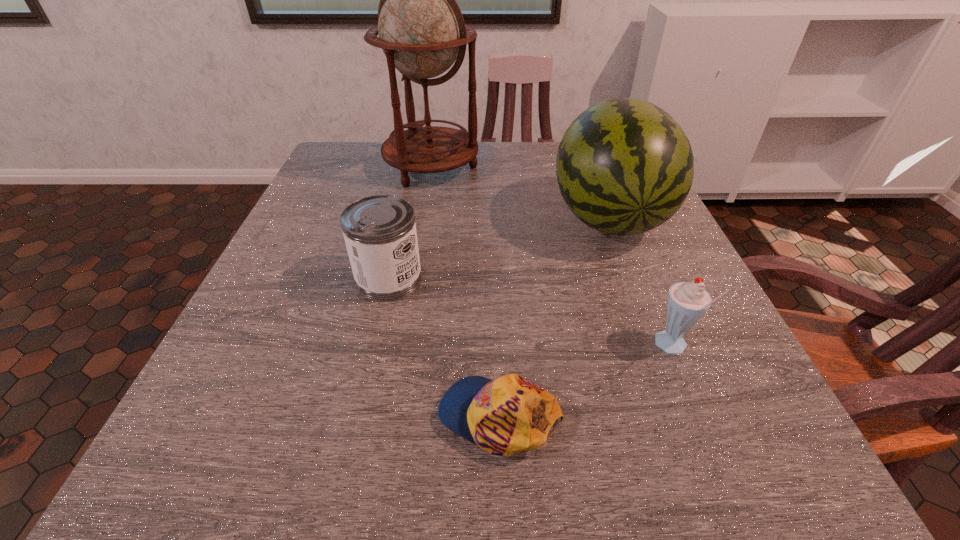
You are a GUI agent. You are given a task and a screenshot of the screen. Output one action in this format:
    pyautogui.click(x=<x>, y=<y>)
    Task: Click on the free point between the watermelon and the shortest object
    This screenshot has width=960, height=540.
    Given the screenshot: What is the action you would take?
    pyautogui.click(x=555, y=317)

Where is `free space between the shortest object and the fourth shortest object`? This screenshot has width=960, height=540. free space between the shortest object and the fourth shortest object is located at coordinates (555, 317).

Identify the location of vacant region between the fourth shortest object and the globe. The width and height of the screenshot is (960, 540). (520, 192).

Locate an element on the screen. The height and width of the screenshot is (540, 960). free space between the watermelon and the can is located at coordinates (499, 248).

This screenshot has width=960, height=540. I want to click on blank region between the tallest object and the watermelon, so click(520, 192).

Choose which object is the nearest neighbor to the cap. Please provide its 2D coordinates. Your answer should be formatted as a tuple, i.e. [(x, y)], where the tuple contains the x and y coordinates of a point satisfying the conditions above.

[(687, 302)]

Identify which object is the third closest to the tallest object. Please provide its 2D coordinates. Your answer should be formatted as a tuple, i.e. [(x, y)], where the tuple contains the x and y coordinates of a point satisfying the conditions above.

[(687, 302)]

Where is `free region that satisfies the following two spatial constraints: 1. at the stem end of the second tallest object; 2. on the bill of the nearest object`? This screenshot has height=540, width=960. free region that satisfies the following two spatial constraints: 1. at the stem end of the second tallest object; 2. on the bill of the nearest object is located at coordinates (684, 416).

The image size is (960, 540). In order to click on vacant area that satisfies the following two spatial constraints: 1. at the stem end of the watermelon; 2. on the bill of the cap in this screenshot , I will do `click(684, 416)`.

At what (x,y) coordinates should I click in order to perform the action: click on vacant region that satisfies the following two spatial constraints: 1. at the stem end of the second tallest object; 2. on the bill of the shortest object. Please return your answer as a coordinate pair (x, y). This screenshot has height=540, width=960. Looking at the image, I should click on (684, 416).